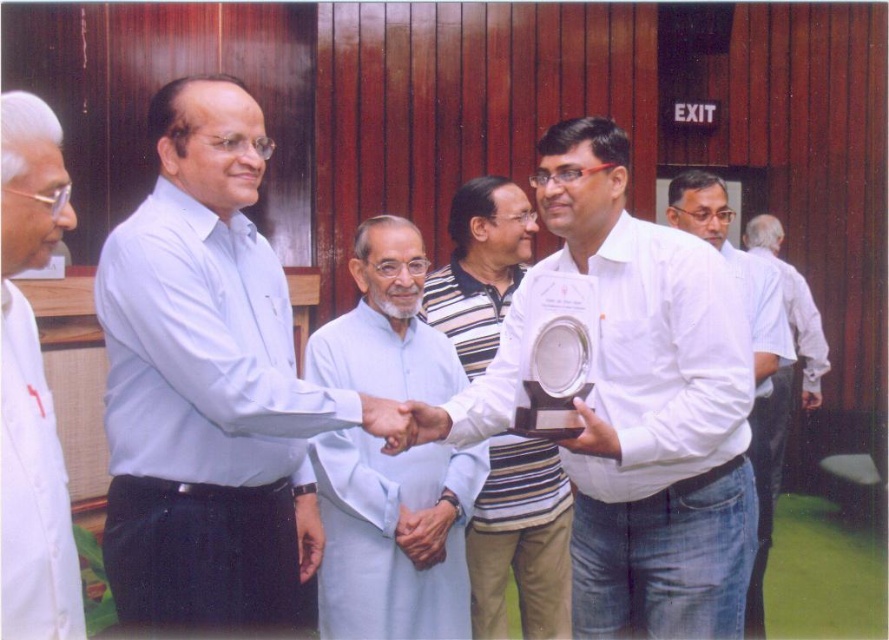
You are standing at the point marked as point (783, 387) in the image. Which object from the scene are you currently standing on?

The point (783, 387) is on the white shirt at right, so you are standing on the white shirt at right.

You are a photographer at the event. You need to capture a photo where the smooth skin hand at center is visible in front of the white shirt at right. Is this possible given their current positions?

The smooth skin hand at center is behind the white shirt at right, so it cannot be seen in front of it in the current arrangement.